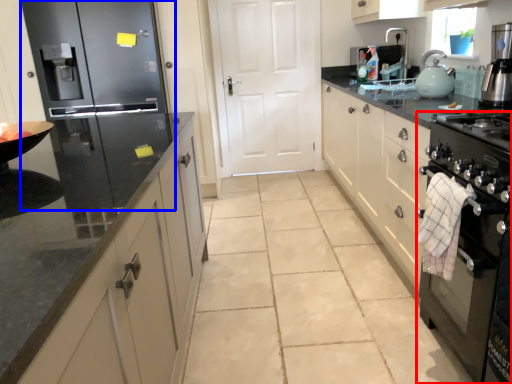
Question: Which point is further to the camera, home appliance (highlighted by a red box) or refrigerator (highlighted by a blue box)?

Choices:
 (A) home appliance
 (B) refrigerator

Answer: (B)